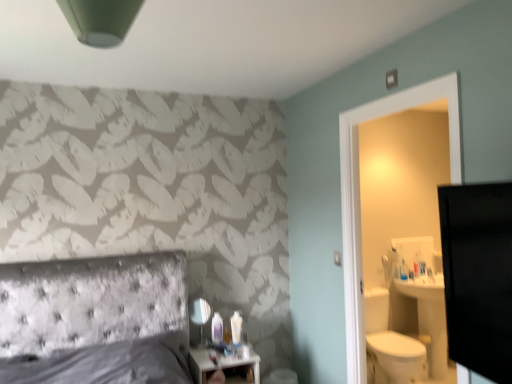
Question: Could you tell me if matte glass mirror at center is facing white glossy nightstand at lower center?

Choices:
 (A) yes
 (B) no

Answer: (B)

Question: Is matte glass mirror at center to the left of white glossy nightstand at lower center from the viewer's perspective?

Choices:
 (A) no
 (B) yes

Answer: (B)

Question: From the image's perspective, does matte glass mirror at center appear higher than white glossy nightstand at lower center?

Choices:
 (A) no
 (B) yes

Answer: (B)

Question: Is matte glass mirror at center shorter than white glossy nightstand at lower center?

Choices:
 (A) yes
 (B) no

Answer: (A)

Question: Is matte glass mirror at center completely or partially outside of white glossy nightstand at lower center?

Choices:
 (A) yes
 (B) no

Answer: (A)

Question: From a real-world perspective, is matte glass mirror at center on top of white glossy nightstand at lower center?

Choices:
 (A) no
 (B) yes

Answer: (B)

Question: Can you confirm if matte glass mirror at center is wider than white plastic lotion at center?

Choices:
 (A) yes
 (B) no

Answer: (A)

Question: From a real-world perspective, does matte glass mirror at center stand above white plastic lotion at center?

Choices:
 (A) no
 (B) yes

Answer: (B)

Question: From the image's perspective, is matte glass mirror at center under white plastic lotion at center?

Choices:
 (A) no
 (B) yes

Answer: (A)

Question: Can you confirm if matte glass mirror at center is bigger than white plastic lotion at center?

Choices:
 (A) yes
 (B) no

Answer: (A)

Question: Is matte glass mirror at center positioned in front of white plastic lotion at center?

Choices:
 (A) yes
 (B) no

Answer: (A)

Question: Is matte glass mirror at center positioned behind white plastic lotion at center?

Choices:
 (A) yes
 (B) no

Answer: (B)

Question: Can you confirm if white plastic lotion at center is shorter than white glossy nightstand at lower center?

Choices:
 (A) no
 (B) yes

Answer: (B)